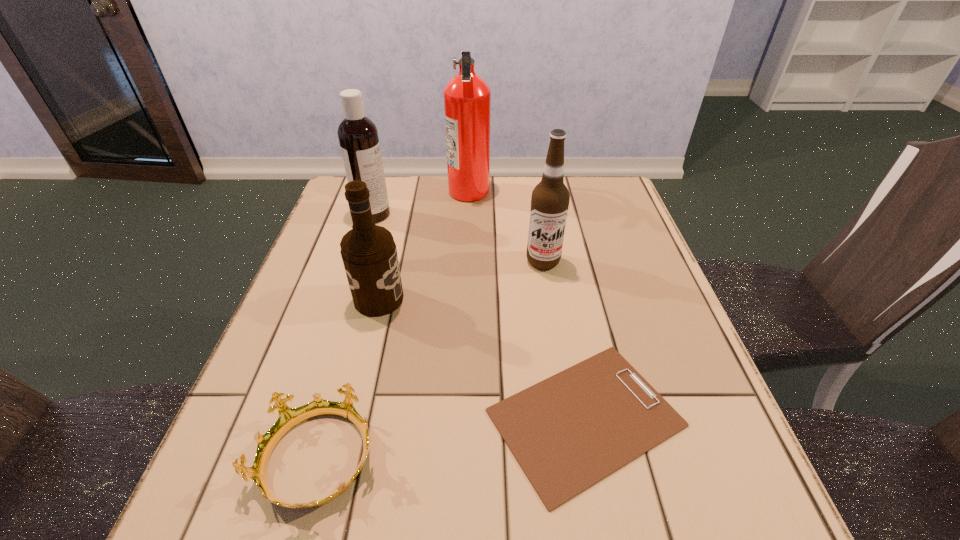
Locate an element on the screen. crown present at the left edge is located at coordinates [x=288, y=418].

This screenshot has height=540, width=960. I want to click on object that is at the right edge, so click(568, 432).

The width and height of the screenshot is (960, 540). In order to click on object located at the far left corner in this screenshot , I will do `click(358, 137)`.

Find the location of `object positioned at the near left corner`. object positioned at the near left corner is located at coordinates (288, 418).

Locate an element on the screen. Image resolution: width=960 pixels, height=540 pixels. object present at the near right corner is located at coordinates (568, 432).

I want to click on vacant position at the far edge of the desktop, so click(518, 204).

You are a GUI agent. You are given a task and a screenshot of the screen. Output one action in this format:
    pyautogui.click(x=<x>, y=<y>)
    Task: Click on the free space at the left edge of the desktop
    
    Given the screenshot: What is the action you would take?
    pyautogui.click(x=277, y=359)

Where is `free point at the right edge`? This screenshot has height=540, width=960. free point at the right edge is located at coordinates (607, 273).

Identify the location of vacant space at the near left corner of the desktop. (267, 531).

Identify the location of free space between the fire extinguisher and the dishwasher detergent. (421, 202).